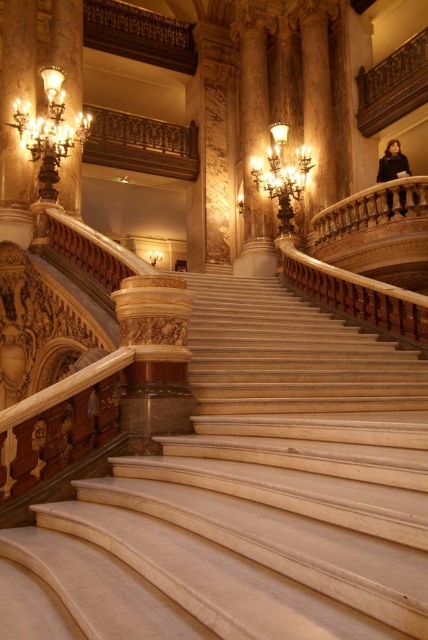
You are an interior designer assessing the grand staircase. You notice the carved wood balustrade at upper center and the gold metallic chandelier at upper center. Which object is larger in size?

The gold metallic chandelier at upper center is larger in size compared to the carved wood balustrade at upper center.

You are an interior designer assessing the lighting fixtures in the grand staircase. You need to determine which of the two fixtures, the matte bronze sconce at upper left or the gold metallic chandelier at upper center, is narrower. Which one should you choose for a space that requires a more compact fixture?

The matte bronze sconce at upper left is narrower than the gold metallic chandelier at upper center, so it is the better choice for a space requiring a more compact fixture.

You are an interior designer assessing the space for a new sculpture. The sculpture is 1.2 meters tall and needs to be placed near the staircase. Considering the size of the carved wood balustrade at upper center and the gold metallic chandelier at upper left, which object would be a better reference point for ensuring the sculpture doesn

The gold metallic chandelier at upper left is larger than the carved wood balustrade at upper center, so placing the sculpture near the chandelier would provide a better reference for scale and ensure the sculpture doesn